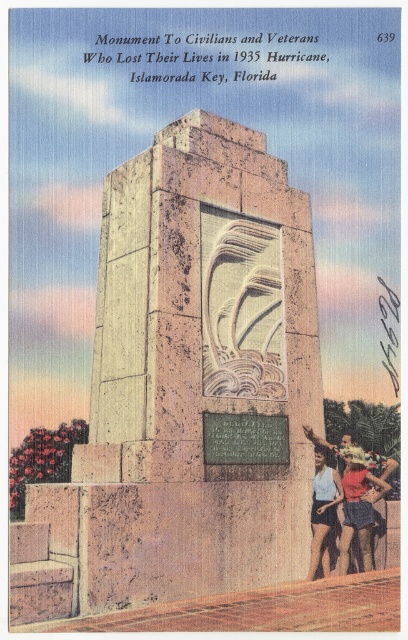
Question: Among these points, which one is farthest from the camera?

Choices:
 (A) pos(325,544)
 (B) pos(365,460)

Answer: (B)

Question: Observing the image, what is the correct spatial positioning of matte blue swimsuit at lower right in reference to denim shorts at lower right?

Choices:
 (A) above
 (B) below

Answer: (B)

Question: Among these objects, which one is nearest to the camera?

Choices:
 (A) denim shorts at lower right
 (B) light blue fabric shorts at lower right

Answer: (B)

Question: Considering the relative positions of matte blue swimsuit at lower right and light blue fabric shorts at lower right in the image provided, where is matte blue swimsuit at lower right located with respect to light blue fabric shorts at lower right?

Choices:
 (A) below
 (B) above

Answer: (A)

Question: Does denim shorts at lower right appear on the right side of light blue fabric shorts at lower right?

Choices:
 (A) yes
 (B) no

Answer: (A)

Question: Which of the following is the farthest from the observer?

Choices:
 (A) matte blue swimsuit at lower right
 (B) light blue fabric shorts at lower right

Answer: (A)